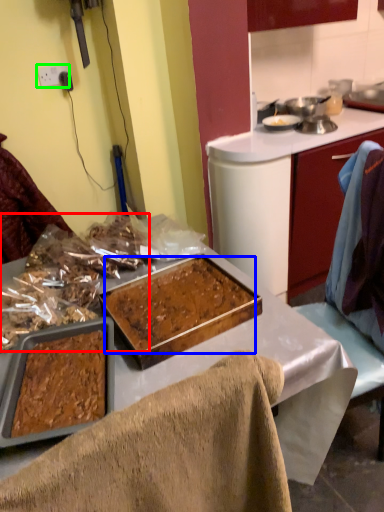
Question: Considering the real-world distances, which object is closest to food (highlighted by a red box)? food (highlighted by a blue box) or power outlet (highlighted by a green box).

Choices:
 (A) food
 (B) power outlet

Answer: (A)